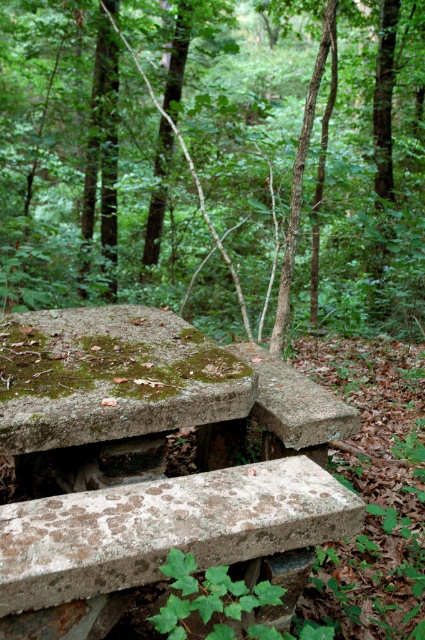
You are a hiker who wants to place a small marker at point (x=214, y=161) in the forest scene. The marker requires a stable surface to be placed. Based on the scene description, is the surface at that point suitable for placing the marker?

The surface at point (x=214, y=161) is the green mossy stone at lower left, which is part of the weathered concrete structure described as having an uneven and eroded surface with rounded edges. Since the concrete shows signs of erosion and wear, the stability of the surface may be compromised, making it unsuitable for placing a marker that requires a stable base.

You are planning to place a small potted plant on the green mossy stone at lower left or the rusty concrete picnic table at upper center. Which surface can support the plant better based on their thickness?

The rusty concrete picnic table at upper center is thicker than the green mossy stone at lower left, so it can support the plant better.

You are standing at the point with coordinates point (57, 534) and want to walk to point (229, 8). Given the rough and eroded concrete surface described in the scene, will you be able to walk directly to your destination without encountering any obstacles?

Since point (229, 8) is behind point (57, 534), you would need to navigate around or through the structure to reach it. The rough and eroded concrete surface might pose challenges, but there are no explicit obstacles mentioned in the scene description that would prevent movement between the two points.